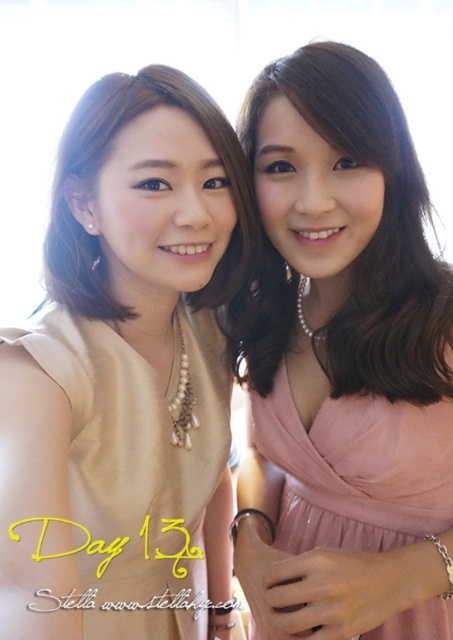
Question: Does matte beige dress at center have a greater width compared to pink satin dress at center?

Choices:
 (A) yes
 (B) no

Answer: (B)

Question: Which point is closer to the camera taking this photo?

Choices:
 (A) [x=283, y=420]
 (B) [x=96, y=365]
 (C) [x=337, y=218]

Answer: (B)

Question: Which point is farther to the camera?

Choices:
 (A) (424, 522)
 (B) (336, 337)
 (C) (53, 579)

Answer: (B)

Question: Is the position of pink satin dress at center less distant than that of pink satin dress at right?

Choices:
 (A) yes
 (B) no

Answer: (A)

Question: Among these objects, which one is farthest from the camera?

Choices:
 (A) pink satin dress at center
 (B) matte gold necklace at upper left
 (C) pink satin dress at right
 (D) matte beige dress at center

Answer: (B)

Question: In this image, where is matte beige dress at center located relative to pink satin dress at center?

Choices:
 (A) above
 (B) below

Answer: (B)